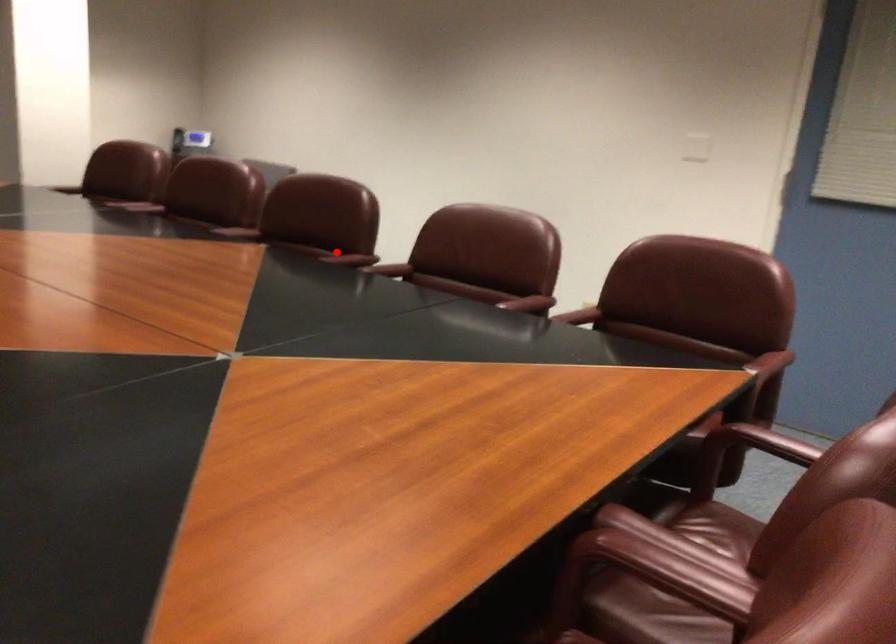
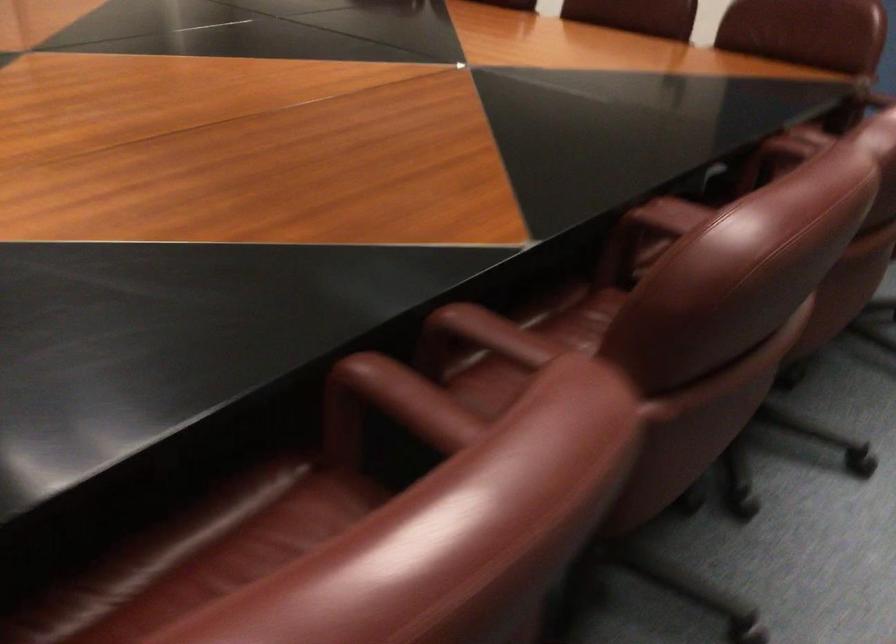
The point at the highlighted location is marked in the first image. Where is the corresponding point in the second image?

(493, 334)